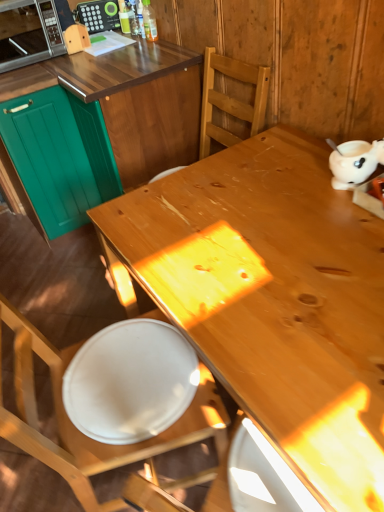
Question: From a real-world perspective, is teal wood cabinetry at left, which is the 2th cabinetry in left-to-right order, physically located above or below natural wood desk at center?

Choices:
 (A) below
 (B) above

Answer: (B)

Question: Looking at the image, does teal wood cabinetry at left, which is the 2th cabinetry in left-to-right order, seem bigger or smaller compared to natural wood desk at center?

Choices:
 (A) small
 (B) big

Answer: (A)

Question: Which is farther from the wooden chair at center?

Choices:
 (A) white glossy plate at lower left
 (B) matte black radio at upper left
 (C) metallic silver microwave at upper left
 (D) teal wood cabinetry at left, which is the 2th cabinetry in left-to-right order
 (E) translucent plastic bottle at upper center

Answer: (B)

Question: Based on their relative distances, which object is nearer to the teal matte cabinet at left, the first cabinetry positioned from the left?

Choices:
 (A) wooden chair at center
 (B) teal wood cabinetry at left, arranged as the 1th cabinetry when viewed from the right
 (C) white glossy plate at lower left
 (D) matte black radio at upper left
 (E) metallic silver microwave at upper left

Answer: (B)